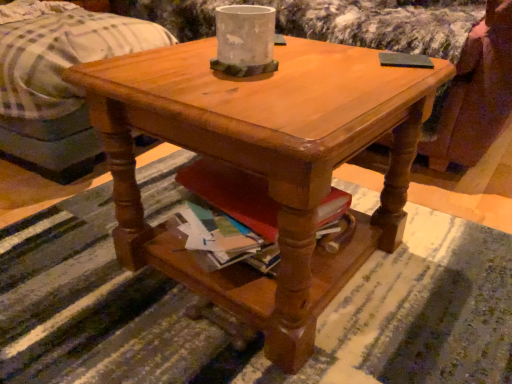
Question: From the image's perspective, is white cotton bed at upper left under white concrete vase at center?

Choices:
 (A) no
 (B) yes

Answer: (A)

Question: Considering the relative positions of white cotton bed at upper left and white concrete vase at center in the image provided, is white cotton bed at upper left to the left of white concrete vase at center from the viewer's perspective?

Choices:
 (A) yes
 (B) no

Answer: (A)

Question: From a real-world perspective, is white cotton bed at upper left over white concrete vase at center?

Choices:
 (A) yes
 (B) no

Answer: (B)

Question: Is white cotton bed at upper left taller than white concrete vase at center?

Choices:
 (A) no
 (B) yes

Answer: (B)

Question: Is white cotton bed at upper left behind white concrete vase at center?

Choices:
 (A) yes
 (B) no

Answer: (A)

Question: Are white cotton bed at upper left and white concrete vase at center far apart?

Choices:
 (A) yes
 (B) no

Answer: (B)

Question: Considering the relative sizes of white concrete vase at center and matte wood coffee table at center in the image provided, is white concrete vase at center thinner than matte wood coffee table at center?

Choices:
 (A) yes
 (B) no

Answer: (A)

Question: From the image's perspective, is white concrete vase at center above matte wood coffee table at center?

Choices:
 (A) no
 (B) yes

Answer: (B)

Question: Can you confirm if white concrete vase at center is taller than matte wood coffee table at center?

Choices:
 (A) no
 (B) yes

Answer: (A)

Question: Is white concrete vase at center next to matte wood coffee table at center and touching it?

Choices:
 (A) no
 (B) yes

Answer: (A)

Question: From the image's perspective, is white concrete vase at center under matte wood coffee table at center?

Choices:
 (A) no
 (B) yes

Answer: (A)

Question: Does white concrete vase at center have a lesser height compared to matte wood coffee table at center?

Choices:
 (A) no
 (B) yes

Answer: (B)

Question: Is the depth of matte wood coffee table at center less than that of white concrete vase at center?

Choices:
 (A) yes
 (B) no

Answer: (A)